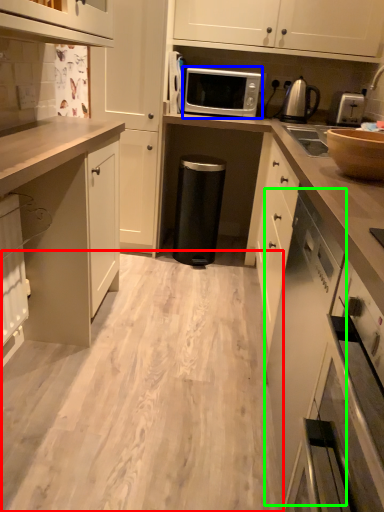
Question: Considering the real-world distances, which object is farthest from plain (highlighted by a red box)? microwave oven (highlighted by a blue box) or cabinetry (highlighted by a green box)?

Choices:
 (A) microwave oven
 (B) cabinetry

Answer: (A)